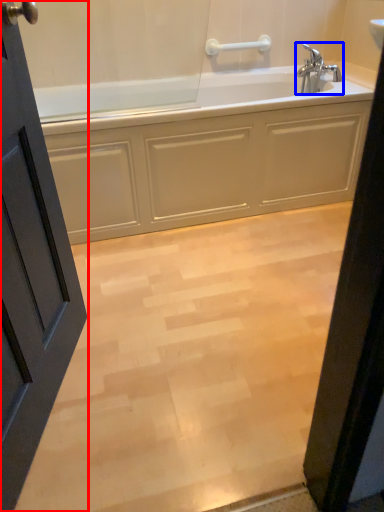
Question: Which point is closer to the camera, door (highlighted by a red box) or tap (highlighted by a blue box)?

Choices:
 (A) door
 (B) tap

Answer: (A)